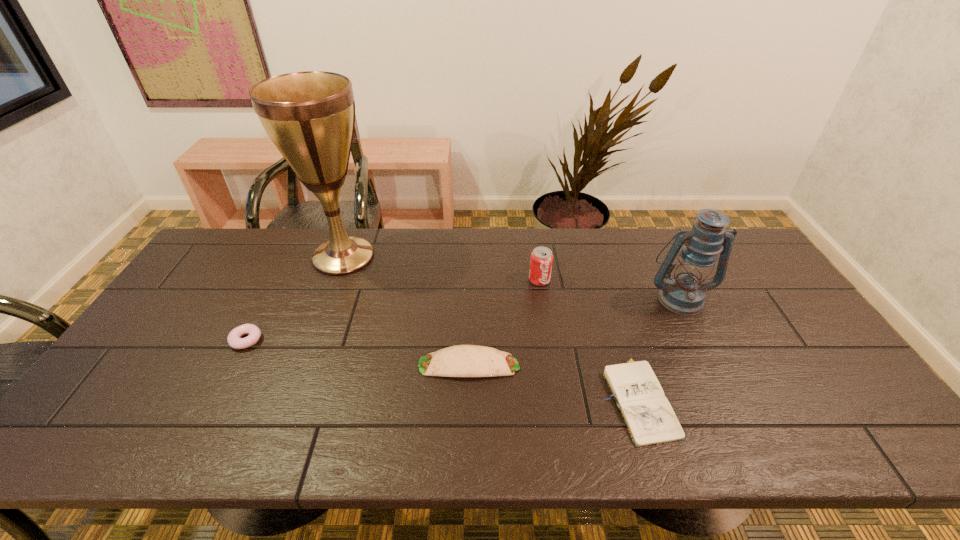
You are a GUI agent. You are given a task and a screenshot of the screen. Output one action in this format:
    pyautogui.click(x=<x>, y=<y>)
    Task: Click on the empty location between the fifth object from left to right and the lantern
    
    Given the screenshot: What is the action you would take?
    tap(659, 348)

What are the coordinates of `blank region between the burrito and the leftmost object` in the screenshot? It's located at (358, 353).

At what (x,y) coordinates should I click in order to perform the action: click on vacant region between the leftmost object and the burrito. Please return your answer as a coordinate pair (x, y). The width and height of the screenshot is (960, 540). Looking at the image, I should click on (358, 353).

Locate an element on the screen. object that ranks as the second closest to the third object from left to right is located at coordinates (541, 260).

Choose which object is the second nearest neighbor to the fourth object from right to left. Please provide its 2D coordinates. Your answer should be formatted as a tuple, i.e. [(x, y)], where the tuple contains the x and y coordinates of a point satisfying the conditions above.

[(541, 260)]

Locate an element on the screen. free space that satisfies the following two spatial constraints: 1. on the front-facing side of the rightmost object; 2. at the bitten end of the burrito is located at coordinates (712, 365).

This screenshot has height=540, width=960. In order to click on free spot that satisfies the following two spatial constraints: 1. on the front-facing side of the lantern; 2. at the bitten end of the third object from left to right in this screenshot , I will do `click(712, 365)`.

Image resolution: width=960 pixels, height=540 pixels. Find the location of `free spot that satisfies the following two spatial constraints: 1. on the back side of the second object from left to right; 2. on the left side of the leftmost object`. free spot that satisfies the following two spatial constraints: 1. on the back side of the second object from left to right; 2. on the left side of the leftmost object is located at coordinates (290, 256).

Find the location of a particular element. free spot that satisfies the following two spatial constraints: 1. on the back side of the doughnut; 2. on the left side of the soda can is located at coordinates (277, 280).